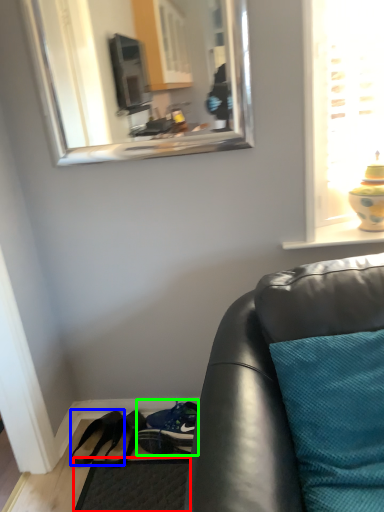
Question: Estimate the real-world distances between objects in this image. Which object is farther from flat (highlighted by a red box), footwear (highlighted by a blue box) or shoe (highlighted by a green box)?

Choices:
 (A) footwear
 (B) shoe

Answer: (A)